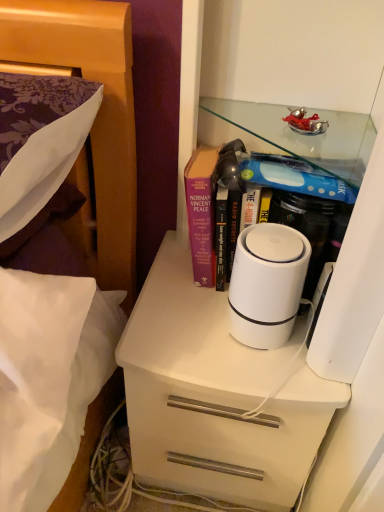
Find the location of a particular element. vacant space in front of white matte cylindrical device at center is located at coordinates (262, 379).